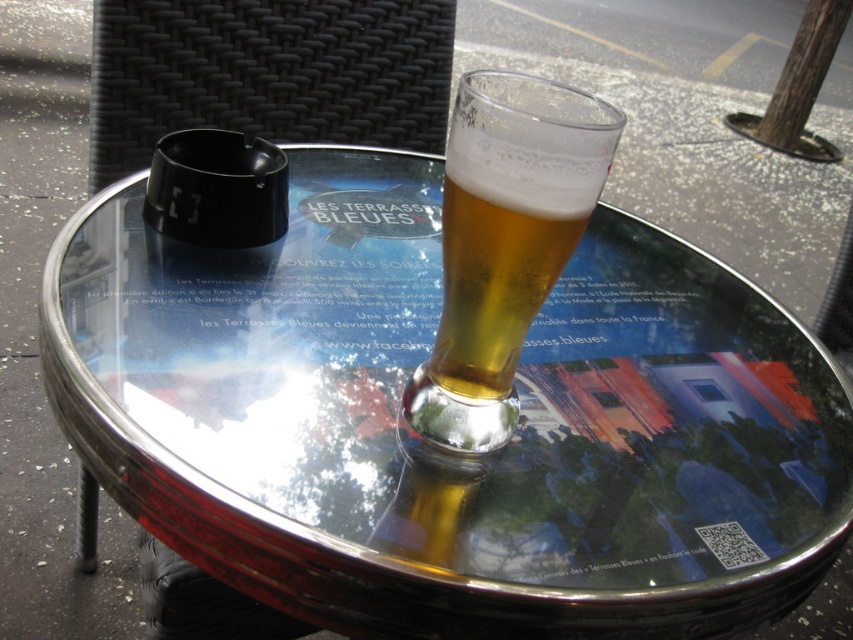
Question: Can you confirm if transparent glass table at center is bigger than translucent glass beer at center?

Choices:
 (A) yes
 (B) no

Answer: (A)

Question: Which object appears farthest from the camera in this image?

Choices:
 (A) translucent glass beer at center
 (B) transparent glass table at center

Answer: (B)

Question: Is transparent glass table at center to the right of translucent glass beer at center from the viewer's perspective?

Choices:
 (A) yes
 (B) no

Answer: (A)

Question: Which object appears closest to the camera in this image?

Choices:
 (A) transparent glass table at center
 (B) translucent glass beer at center

Answer: (B)

Question: Can you confirm if transparent glass table at center is wider than translucent glass beer at center?

Choices:
 (A) no
 (B) yes

Answer: (B)